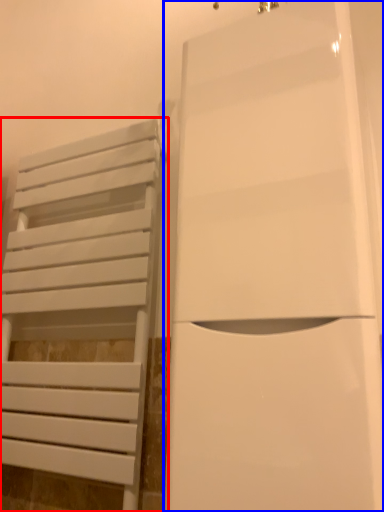
Question: Which object appears farthest to the camera in this image, furniture (highlighted by a red box) or door (highlighted by a blue box)?

Choices:
 (A) furniture
 (B) door

Answer: (A)